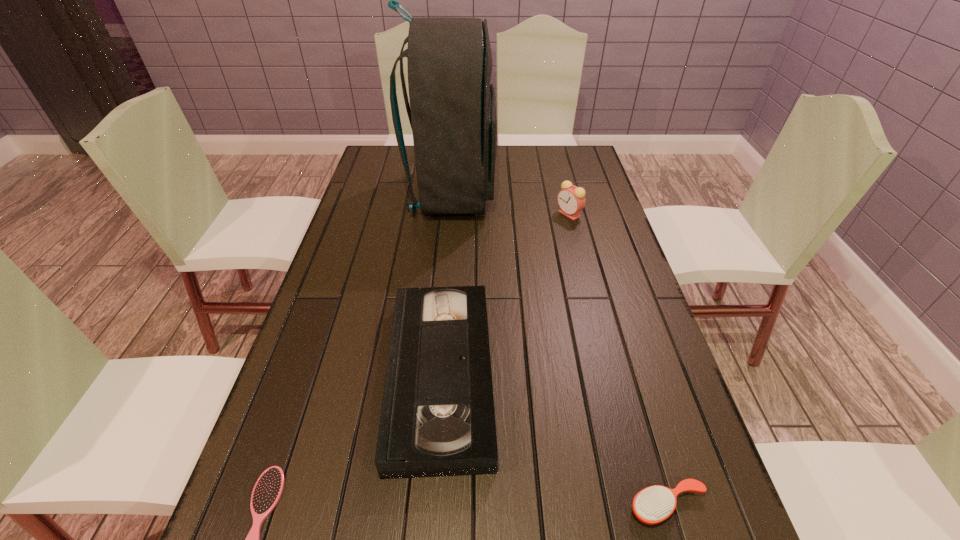
Find the location of a particular element. This screenshot has width=960, height=540. empty space between the third tallest object and the alarm clock is located at coordinates (505, 295).

Identify the location of vacant region between the backpack and the third tallest object. (446, 286).

This screenshot has width=960, height=540. In order to click on empty space that is in between the tallest object and the fourth shortest object in this screenshot , I will do `click(511, 204)`.

Find the location of `free space between the alarm clock and the third shortest object`. free space between the alarm clock and the third shortest object is located at coordinates (505, 295).

Where is `free space between the videotape and the second shortest object`? free space between the videotape and the second shortest object is located at coordinates (554, 441).

Identify the location of free space between the videotape and the tallest object. This screenshot has height=540, width=960. tap(446, 286).

The image size is (960, 540). I want to click on object that is the fourth closest to the left hairbrush, so click(571, 199).

Choose which object is the second nearest neighbor to the right hairbrush. Please provide its 2D coordinates. Your answer should be formatted as a tuple, i.e. [(x, y)], where the tuple contains the x and y coordinates of a point satisfying the conditions above.

[(268, 489)]

Find the location of a particular element. Image resolution: width=960 pixels, height=540 pixels. free space in the image that satisfies the following two spatial constraints: 1. on the front-facing side of the tallest object; 2. on the right side of the videotape is located at coordinates (437, 376).

Where is `blank space that satisfies the following two spatial constraints: 1. on the front-facing side of the taller hairbrush; 2. on the right side of the tallest object`? This screenshot has width=960, height=540. blank space that satisfies the following two spatial constraints: 1. on the front-facing side of the taller hairbrush; 2. on the right side of the tallest object is located at coordinates (426, 505).